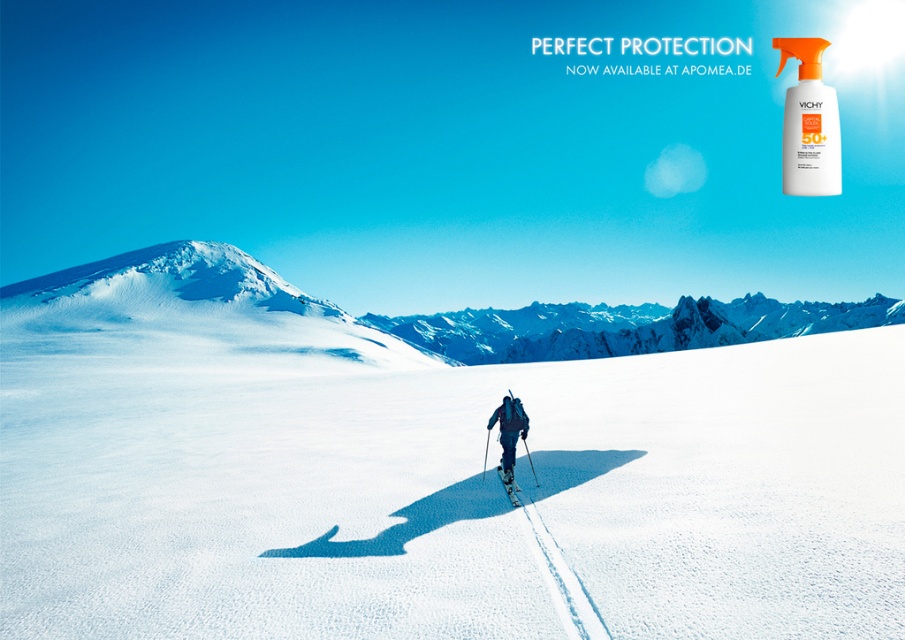
You are planning to take a photo of the dark blue ski suit at center and the shiny blue ski at center in the winter landscape. Which object would you need to focus on more carefully to ensure it is captured clearly due to its size?

The dark blue ski suit at center has a larger size compared to the shiny blue ski at center, so you should focus more on capturing the dark blue ski suit at center clearly because of its bigger size.

You are a drone operator tasked with capturing aerial footage of the winter landscape. You need to ensure that the camera is positioned exactly at point (458, 497). What will the camera primarily capture at that coordinate?

The camera positioned at point (458, 497) will primarily capture white powder snow at center.